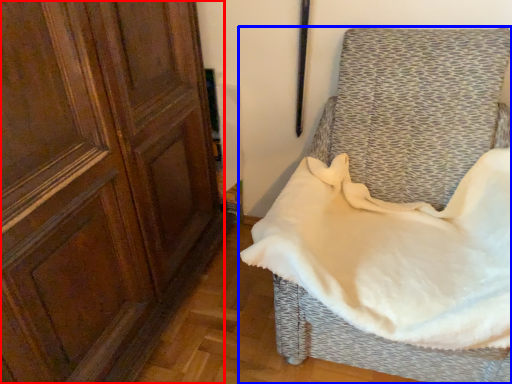
Question: Which point is closer to the camera, screen door (highlighted by a red box) or furniture (highlighted by a blue box)?

Choices:
 (A) screen door
 (B) furniture

Answer: (A)